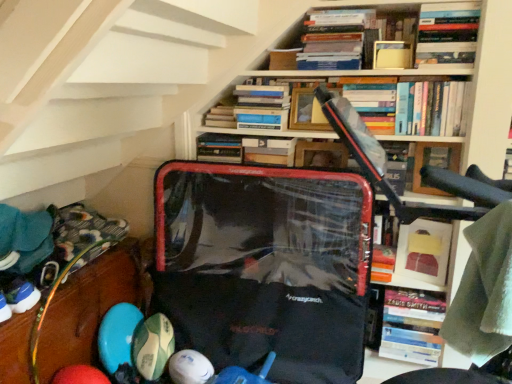
Where is `free space above hardcover book at upper center, the 4th book in the top-to-bottom sequence (from a real-world perspective)`? Image resolution: width=512 pixels, height=384 pixels. free space above hardcover book at upper center, the 4th book in the top-to-bottom sequence (from a real-world perspective) is located at coordinates (248, 84).